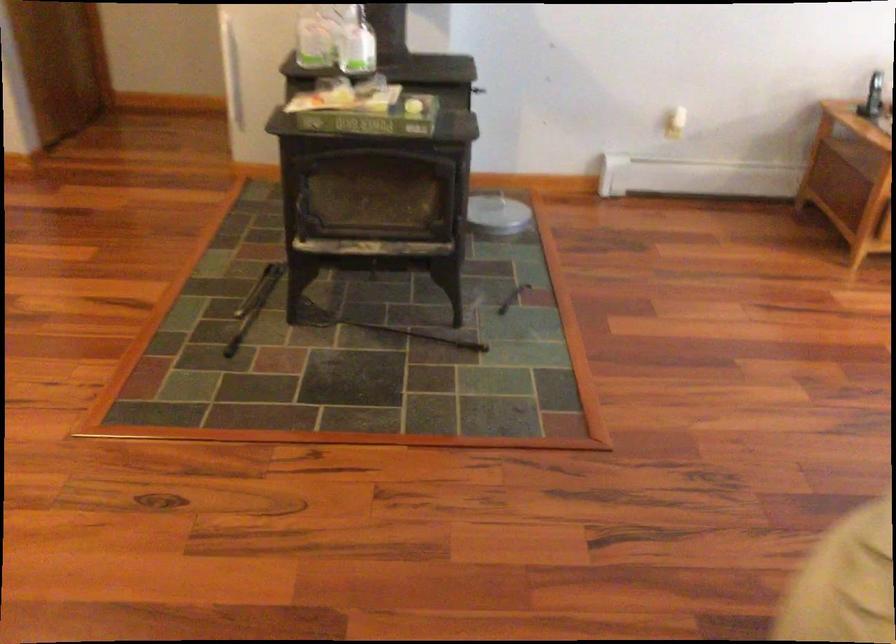
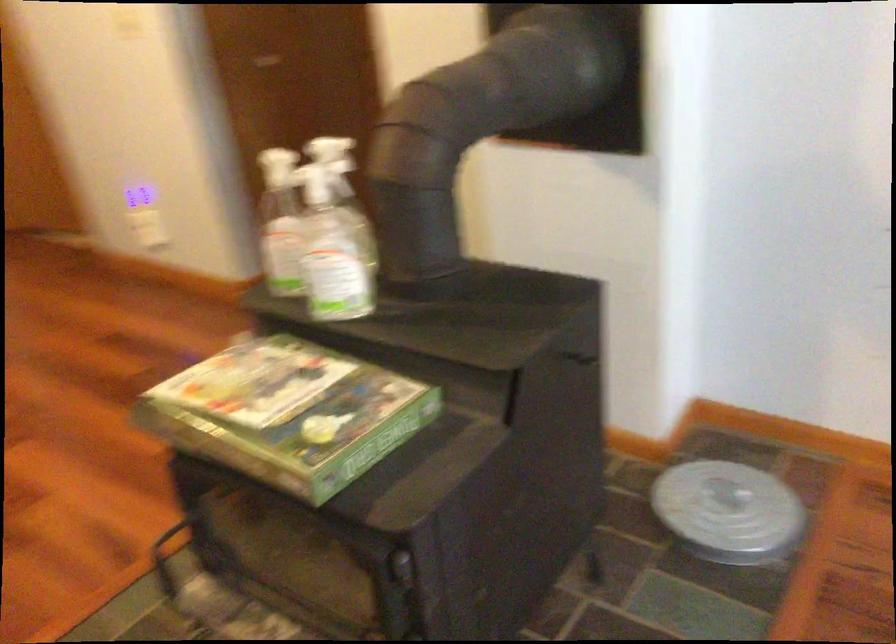
Find the pixel in the second image that matches pixel 464 165 in the first image.

(401, 567)